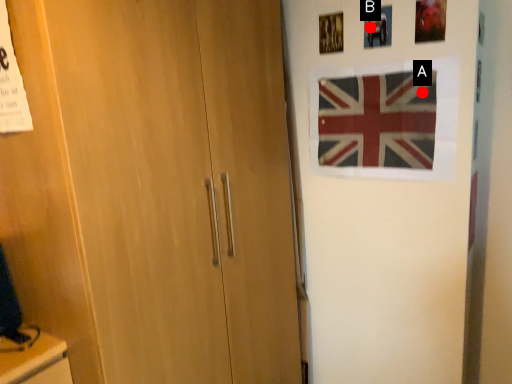
Question: Two points are circled on the image, labeled by A and B beside each circle. Which of the following is the closest to the observer?

Choices:
 (A) A is closer
 (B) B is closer

Answer: (A)